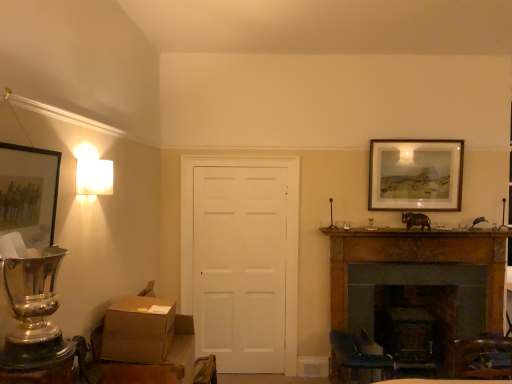
Question: Is matte black picture frame at left, arranged as the second picture frame when viewed from the back, closer to camera compared to brown cardboard box at lower left?

Choices:
 (A) no
 (B) yes

Answer: (B)

Question: Considering the relative sizes of matte black picture frame at left, placed as the 2th picture frame when sorted from right to left, and brown cardboard box at lower left in the image provided, is matte black picture frame at left, placed as the 2th picture frame when sorted from right to left, thinner than brown cardboard box at lower left?

Choices:
 (A) no
 (B) yes

Answer: (B)

Question: Is matte black picture frame at left, acting as the first picture frame starting from the front, positioned beyond the bounds of brown cardboard box at lower left?

Choices:
 (A) yes
 (B) no

Answer: (A)

Question: Is matte black picture frame at left, placed as the 2th picture frame when sorted from right to left, facing towards brown cardboard box at lower left?

Choices:
 (A) yes
 (B) no

Answer: (B)

Question: Does matte black picture frame at left, which ranks as the first picture frame in left-to-right order, have a larger size compared to brown cardboard box at lower left?

Choices:
 (A) yes
 (B) no

Answer: (B)

Question: Is matte black picture frame at left, acting as the first picture frame starting from the front, to the right of brown cardboard box at lower left from the viewer's perspective?

Choices:
 (A) yes
 (B) no

Answer: (B)

Question: Is brown cardboard box at lower left not near white matte door at center?

Choices:
 (A) no
 (B) yes

Answer: (B)

Question: Does brown cardboard box at lower left contain white matte door at center?

Choices:
 (A) yes
 (B) no

Answer: (B)

Question: Is brown cardboard box at lower left shorter than white matte door at center?

Choices:
 (A) yes
 (B) no

Answer: (A)

Question: Can you confirm if brown cardboard box at lower left is taller than white matte door at center?

Choices:
 (A) yes
 (B) no

Answer: (B)

Question: Could you tell me if brown cardboard box at lower left is turned towards white matte door at center?

Choices:
 (A) yes
 (B) no

Answer: (B)

Question: From the image's perspective, is brown cardboard box at lower left on white matte door at center?

Choices:
 (A) yes
 (B) no

Answer: (B)

Question: From the image's perspective, does wooden fireplace at lower right appear lower than matte black picture frame at left, arranged as the second picture frame when viewed from the back?

Choices:
 (A) no
 (B) yes

Answer: (B)